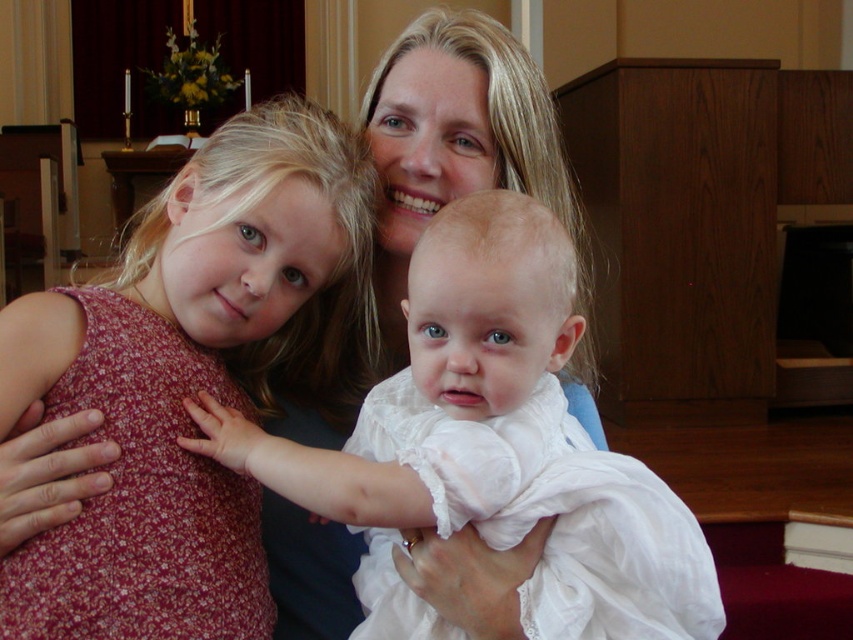
Is floral fabric dress at left taller than white lace dress at center?

Correct, floral fabric dress at left is much taller as white lace dress at center.

This screenshot has width=853, height=640. Identify the location of floral fabric dress at left. (198, 381).

Is point (206, 490) in front of point (503, 257)?

No, (206, 490) is behind (503, 257).

Where is `floral fabric dress at left`? The width and height of the screenshot is (853, 640). floral fabric dress at left is located at coordinates (198, 381).